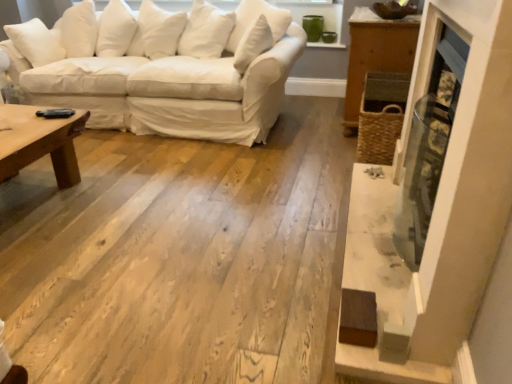
Question: Considering the positions of white cotton couch at upper left and metallic glass fireplace at right in the image, is white cotton couch at upper left wider or thinner than metallic glass fireplace at right?

Choices:
 (A) wide
 (B) thin

Answer: (A)

Question: From the image's perspective, is white cotton couch at upper left above or below metallic glass fireplace at right?

Choices:
 (A) above
 (B) below

Answer: (A)

Question: In the image, is white cotton couch at upper left positioned in front of or behind metallic glass fireplace at right?

Choices:
 (A) front
 (B) behind

Answer: (B)

Question: Is metallic glass fireplace at right bigger or smaller than white cotton couch at upper left?

Choices:
 (A) small
 (B) big

Answer: (A)

Question: Is point (415, 238) closer or farther from the camera than point (244, 6)?

Choices:
 (A) farther
 (B) closer

Answer: (B)

Question: From their relative heights in the image, would you say metallic glass fireplace at right is taller or shorter than white cotton couch at upper left?

Choices:
 (A) tall
 (B) short

Answer: (A)

Question: Would you say metallic glass fireplace at right is inside or outside white cotton couch at upper left?

Choices:
 (A) outside
 (B) inside

Answer: (A)